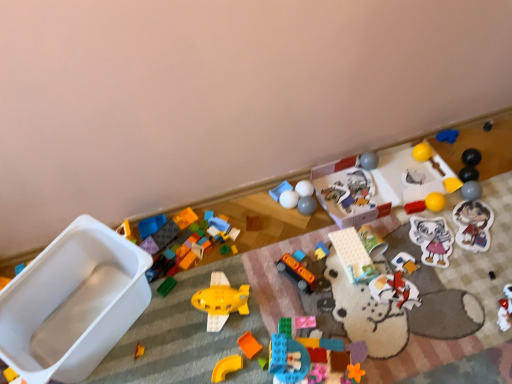
The height and width of the screenshot is (384, 512). Find the location of `vacant space positioned to the left of pink matte block at center, acting as the 14th toy starting from the right`. vacant space positioned to the left of pink matte block at center, acting as the 14th toy starting from the right is located at coordinates (251, 329).